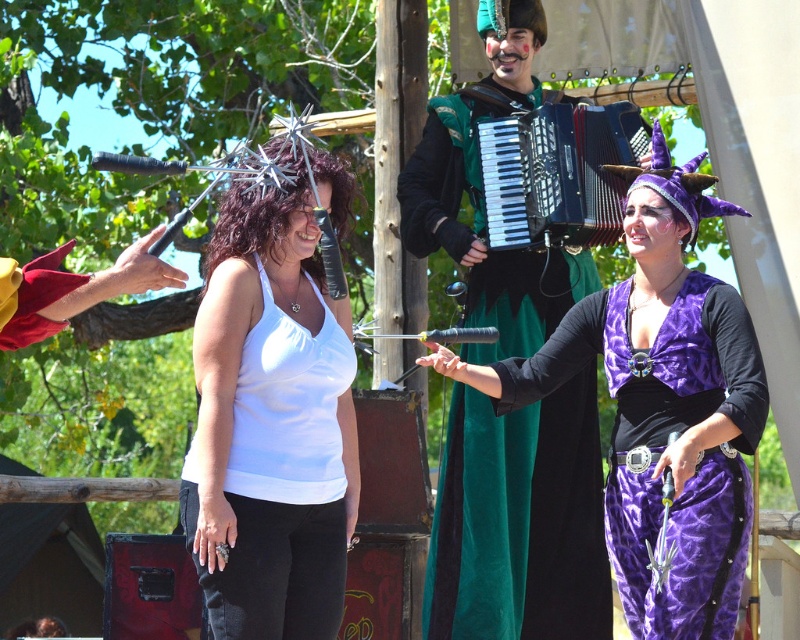
Between velvet green accordion at center and maroon velvet glove at left, which one is positioned higher?

maroon velvet glove at left is higher up.

Does velvet green accordion at center have a larger size compared to maroon velvet glove at left?

Yes, velvet green accordion at center is bigger than maroon velvet glove at left.

This screenshot has height=640, width=800. Describe the element at coordinates (520, 522) in the screenshot. I see `velvet green accordion at center` at that location.

The width and height of the screenshot is (800, 640). What are the coordinates of `velvet green accordion at center` in the screenshot? It's located at (520, 522).

Is purple velvet dress at center positioned before velvet green accordion at center?

That is True.

Based on the photo, can you confirm if purple velvet dress at center is smaller than velvet green accordion at center?

No, purple velvet dress at center is not smaller than velvet green accordion at center.

The height and width of the screenshot is (640, 800). I want to click on purple velvet dress at center, so click(660, 404).

You are a GUI agent. You are given a task and a screenshot of the screen. Output one action in this format:
    pyautogui.click(x=<x>, y=<y>)
    Task: Click on the purple velvet dress at center
    The height and width of the screenshot is (640, 800).
    Given the screenshot: What is the action you would take?
    pyautogui.click(x=660, y=404)

Is purple velvet dress at center closer to camera compared to black plastic accordion at center?

Yes, it is in front of black plastic accordion at center.

Is purple velvet dress at center above black plastic accordion at center?

Actually, purple velvet dress at center is below black plastic accordion at center.

Is point (616, 563) positioned behind point (633, 113)?

No, (616, 563) is in front of (633, 113).

At what (x,y) coordinates should I click in order to perform the action: click on purple velvet dress at center. Please return your answer as a coordinate pair (x, y). Image resolution: width=800 pixels, height=640 pixels. Looking at the image, I should click on (660, 404).